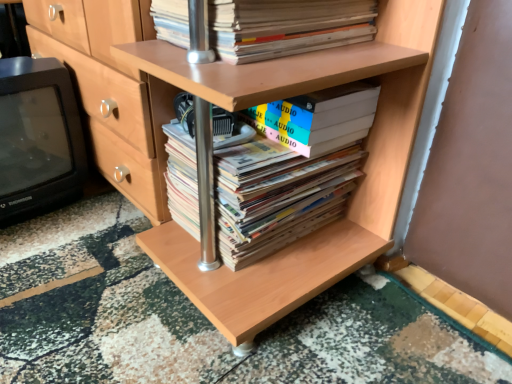
Find the location of a particular element. The image size is (512, 384). blank space situated above hardcover books at center, the 1th book when ordered from bottom to top (from a real-world perspective) is located at coordinates (254, 140).